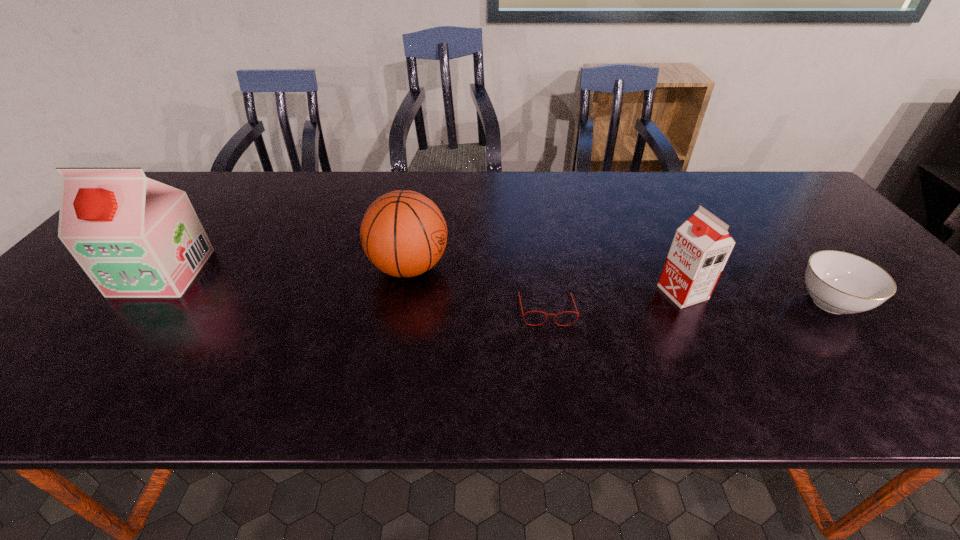
You are a GUI agent. You are given a task and a screenshot of the screen. Output one action in this format:
    pyautogui.click(x=<x>, y=<y>)
    Task: Click on the vacant area that lies between the chinaware and the right soya milk
    The image size is (960, 540).
    Given the screenshot: What is the action you would take?
    pyautogui.click(x=756, y=298)

Find the location of `vacant point located between the chinaware and the basketball`. vacant point located between the chinaware and the basketball is located at coordinates pos(619,285).

Find the location of a particular element. object that is the third nearest to the fourth object from left to right is located at coordinates (403, 233).

Locate which object is the third closest to the basketball. Please provide its 2D coordinates. Your answer should be formatted as a tuple, i.e. [(x, y)], where the tuple contains the x and y coordinates of a point satisfying the conditions above.

[(701, 246)]

Find the location of a particular element. free point that satisfies the following two spatial constraints: 1. with the cap open on the second object from right to left; 2. on the left side of the left soya milk is located at coordinates (147, 292).

Locate an element on the screen. blank area in the image that satisfies the following two spatial constraints: 1. on the front side of the shorter soya milk; 2. on the right side of the rightmost object is located at coordinates (687, 302).

Locate an element on the screen. The image size is (960, 540). free space that satisfies the following two spatial constraints: 1. on the front side of the chinaware; 2. on the left side of the basketball is located at coordinates 402,302.